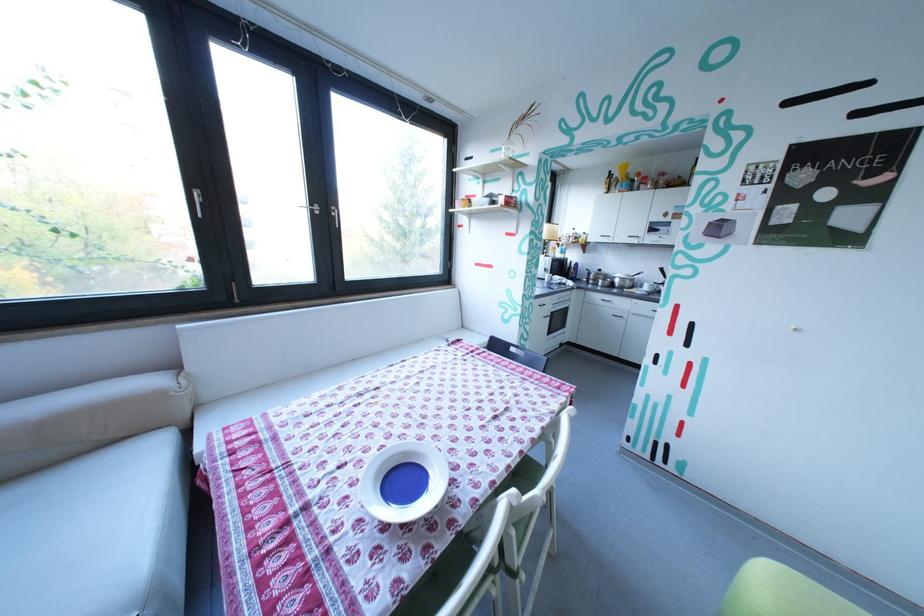
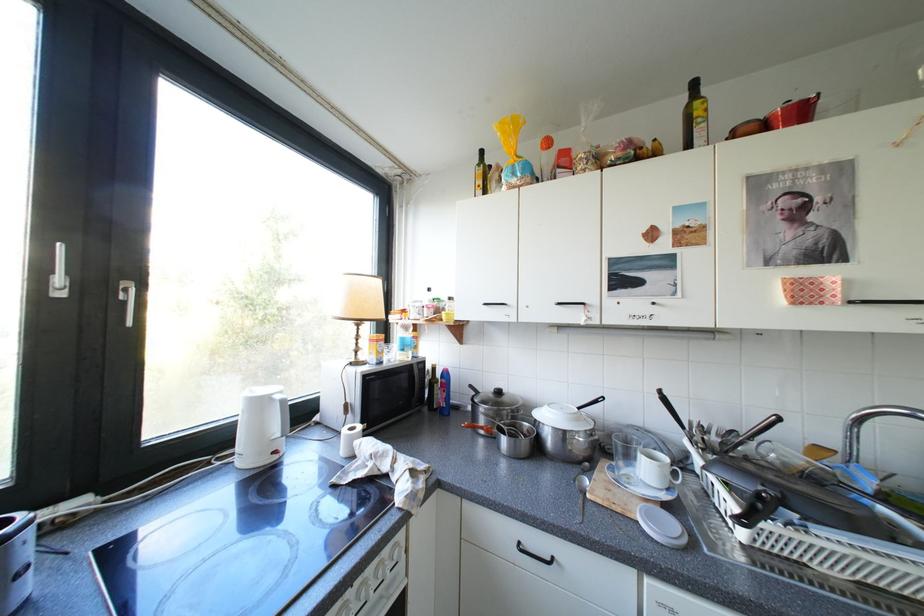
The images are taken continuously from a first-person perspective. In which direction are you moving?

The cameraman moved toward right, forward.